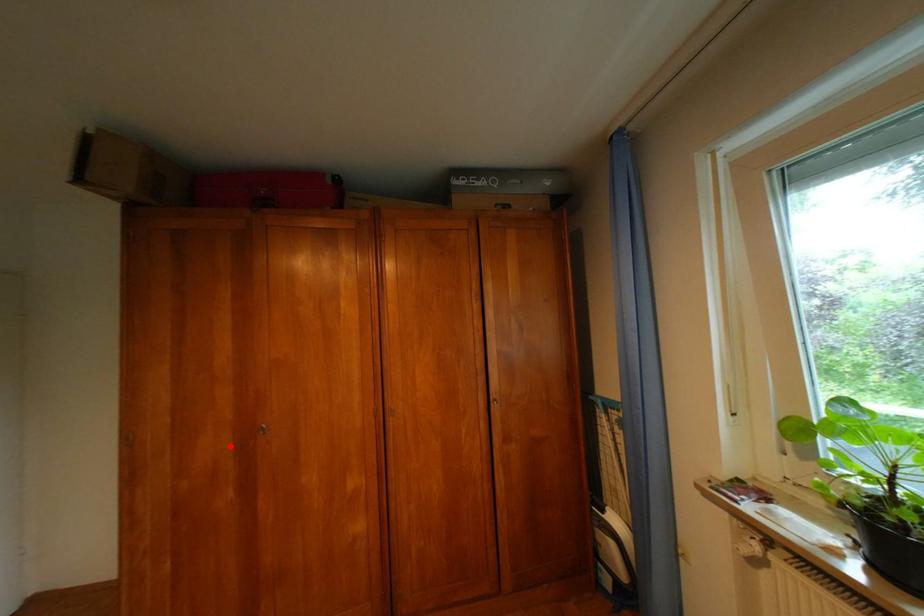
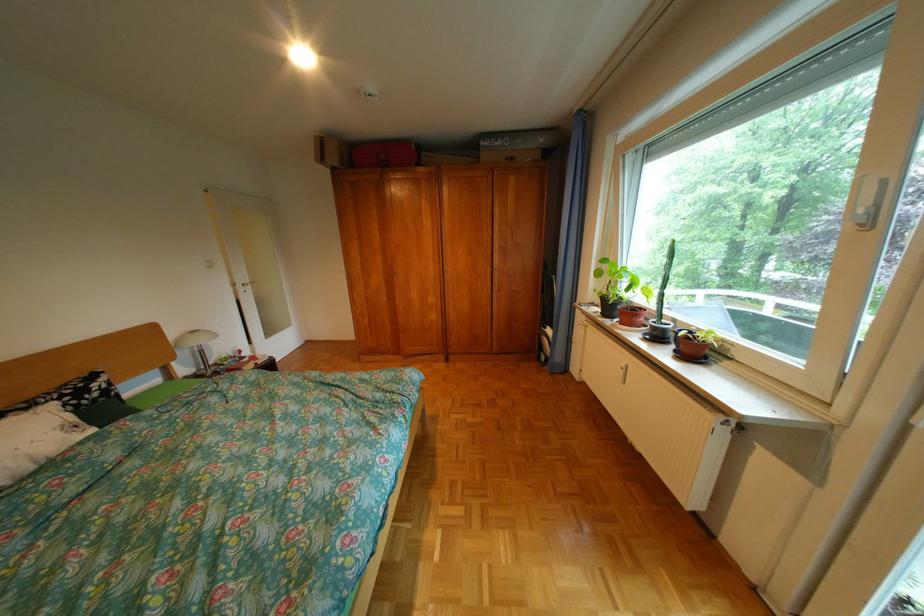
Where in the second image is the point corresponding to the highlighted location from the first image?

(392, 280)